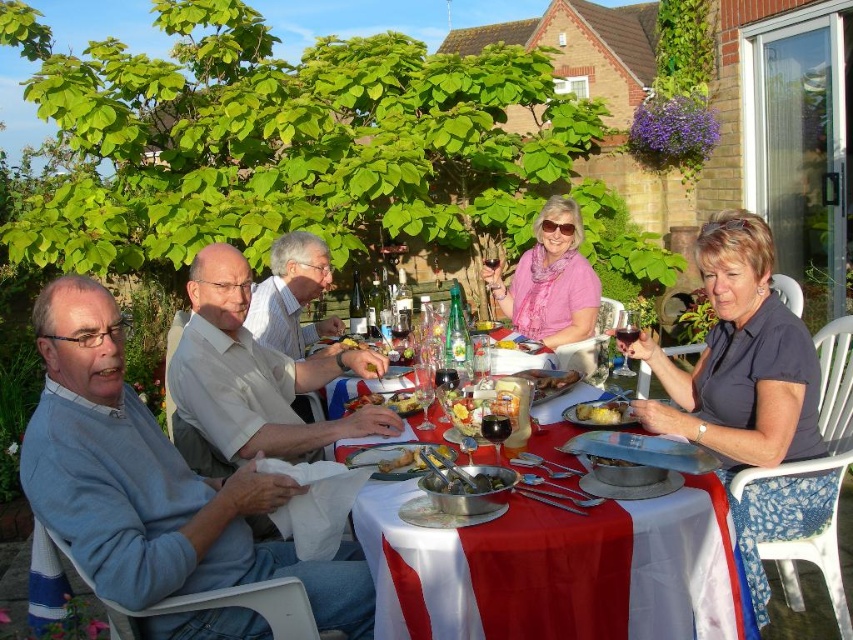
Is white shirt at center positioned before shiny silver fork at center?

Yes, it is.

Can you confirm if white shirt at center is shorter than shiny silver fork at center?

No, white shirt at center is not shorter than shiny silver fork at center.

This screenshot has height=640, width=853. What are the coordinates of `white shirt at center` in the screenshot? It's located at (252, 378).

Between dark blue shirt at upper right and shiny silver tongs at center, which one appears on the right side from the viewer's perspective?

Positioned to the right is dark blue shirt at upper right.

Does dark blue shirt at upper right have a larger size compared to shiny silver tongs at center?

Yes.

Identify the location of dark blue shirt at upper right. (747, 394).

Between light blue sweater at left and shiny silver fork at center, which one has more height?

With more height is light blue sweater at left.

Who is more forward, (257, 628) or (409, 401)?

Point (257, 628) is in front.

You are a GUI agent. You are given a task and a screenshot of the screen. Output one action in this format:
    pyautogui.click(x=<x>, y=<y>)
    Task: Click on the light blue sweater at left
    This screenshot has width=853, height=640.
    Given the screenshot: What is the action you would take?
    pyautogui.click(x=152, y=483)

The width and height of the screenshot is (853, 640). Find the location of `light blue sweater at left`. light blue sweater at left is located at coordinates (152, 483).